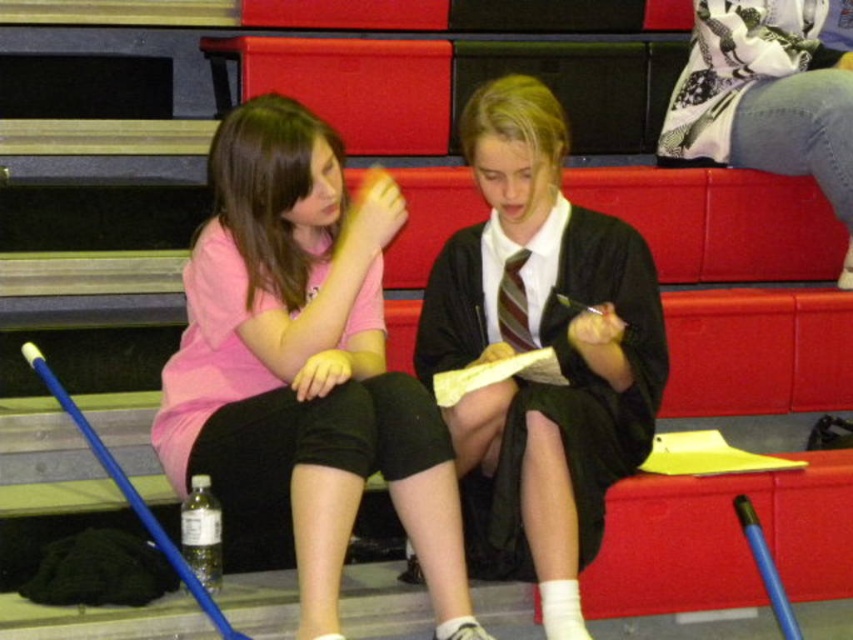
Does pink fabric shirt at left appear on the right side of matte black robe at center?

No, pink fabric shirt at left is not to the right of matte black robe at center.

Which is below, pink fabric shirt at left or matte black robe at center?

pink fabric shirt at left

At what (x,y) coordinates should I click in order to perform the action: click on pink fabric shirt at left. Please return your answer as a coordinate pair (x, y). Image resolution: width=853 pixels, height=640 pixels. Looking at the image, I should click on (305, 365).